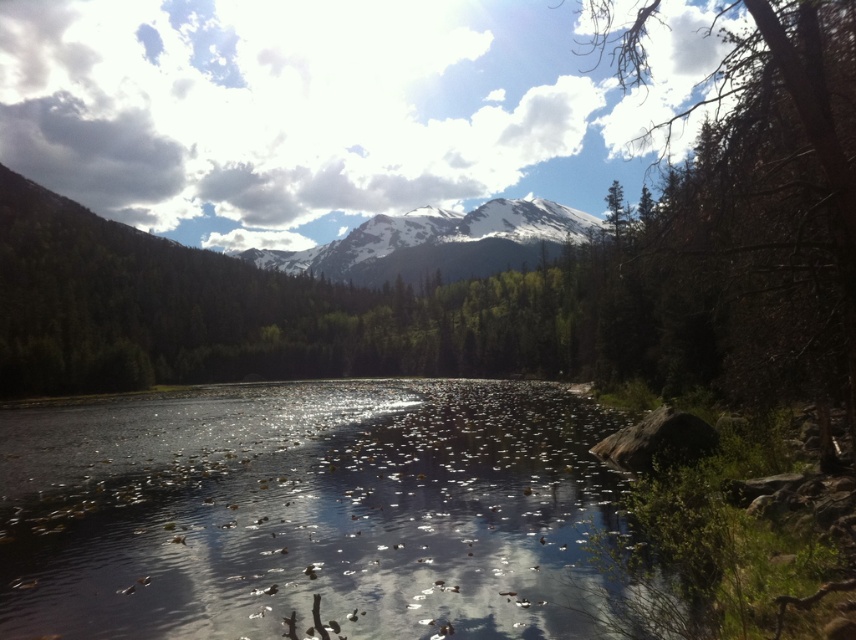
Does translucent water at center have a lesser height compared to snowy white mountain at center?

Indeed, translucent water at center has a lesser height compared to snowy white mountain at center.

Is point (262, 595) positioned in front of point (418, 225)?

Yes, it is in front of point (418, 225).

Is point (159, 504) positioned behind point (409, 221)?

No, (159, 504) is closer to viewer.

The width and height of the screenshot is (856, 640). What are the coordinates of `translucent water at center` in the screenshot? It's located at (306, 513).

Is translucent water at center shorter than green leafy tree at center?

Yes, translucent water at center is shorter than green leafy tree at center.

You are a GUI agent. You are given a task and a screenshot of the screen. Output one action in this format:
    pyautogui.click(x=<x>, y=<y>)
    Task: Click on the translucent water at center
    
    Given the screenshot: What is the action you would take?
    pyautogui.click(x=306, y=513)

Based on the photo, is green leafy tree at center below snowy white mountain at center?

No.

Which is more to the left, green leafy tree at center or snowy white mountain at center?

snowy white mountain at center is more to the left.

I want to click on green leafy tree at center, so click(776, 205).

Identify the location of green leafy tree at center. (776, 205).